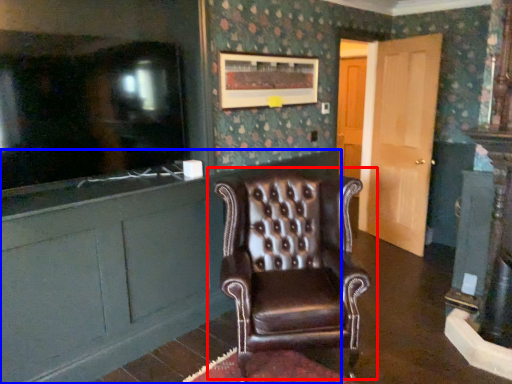
Question: Which object is further to the camera taking this photo, chair (highlighted by a red box) or cabinetry (highlighted by a blue box)?

Choices:
 (A) chair
 (B) cabinetry

Answer: (A)